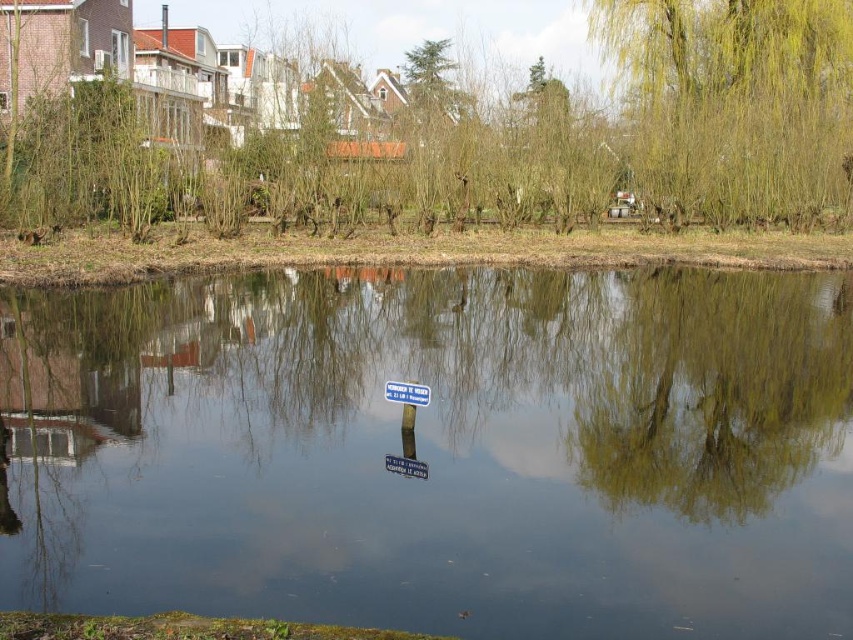
The height and width of the screenshot is (640, 853). Find the location of `transparent glass water at center`. transparent glass water at center is located at coordinates (439, 451).

Between transparent glass water at center and green willow tree at upper right, which one is positioned higher?

Positioned higher is green willow tree at upper right.

Is point (97, 401) closer to camera compared to point (843, 170)?

Yes, point (97, 401) is in front of point (843, 170).

The height and width of the screenshot is (640, 853). I want to click on transparent glass water at center, so click(439, 451).

Which is more to the left, green leafy tree at upper center or green willow tree at upper right?

green leafy tree at upper center

Is green leafy tree at upper center to the right of green willow tree at upper right from the viewer's perspective?

In fact, green leafy tree at upper center is to the left of green willow tree at upper right.

Is point (704, 54) positioned in front of point (770, 195)?

No, it is behind (770, 195).

The width and height of the screenshot is (853, 640). I want to click on green leafy tree at upper center, so click(462, 118).

Measure the distance between point (463, 572) and camera.

Point (463, 572) is 20.54 feet away from camera.

Looking at this image, between transparent glass water at center and green leafy tree at upper center, which one is positioned lower?

Positioned lower is transparent glass water at center.

What do you see at coordinates (439, 451) in the screenshot? I see `transparent glass water at center` at bounding box center [439, 451].

Locate an element on the screen. The width and height of the screenshot is (853, 640). transparent glass water at center is located at coordinates (439, 451).